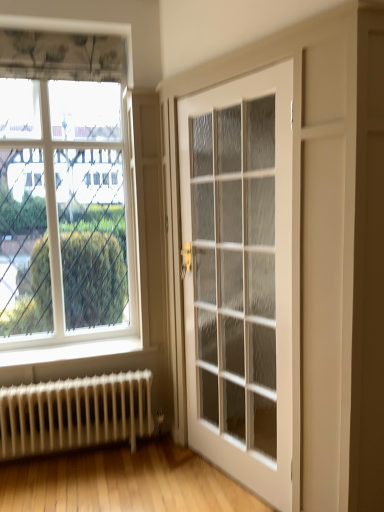
This screenshot has height=512, width=384. Find the location of `free space above white glossy door at center (from a real-world perspective)`. free space above white glossy door at center (from a real-world perspective) is located at coordinates (229, 81).